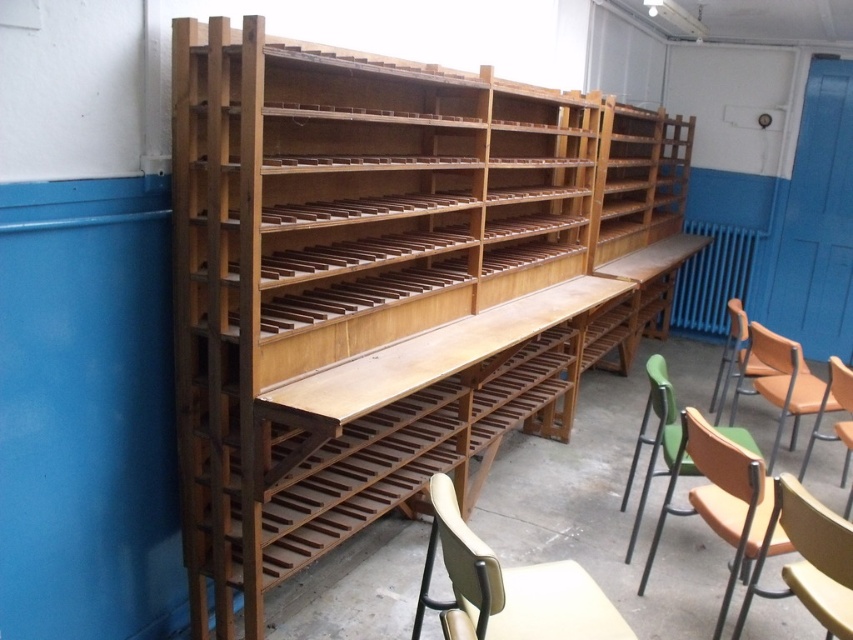
Between light brown wood chair at lower right and green plastic chair at right, which one has more height?

green plastic chair at right

Who is shorter, light brown wood chair at lower right or green plastic chair at right?

Standing shorter between the two is light brown wood chair at lower right.

Which is behind, point (784, 531) or point (721, 378)?

The point (721, 378) is behind.

This screenshot has height=640, width=853. I want to click on light brown wood chair at lower right, so click(816, 556).

Between point (663, 250) and point (793, 424), which one is positioned behind?

The point (663, 250) is behind.

Can you confirm if natural wood bookshelf at center is shorter than matte orange chair at right?

Incorrect, natural wood bookshelf at center's height does not fall short of matte orange chair at right's.

Which is in front, point (183, 484) or point (775, 442)?

Point (183, 484) is in front.

Identify the location of natural wood bookshelf at center. The image size is (853, 640). (384, 282).

Consider the image. Who is taller, green plastic chair at lower right or matte orange chair at right?

Standing taller between the two is green plastic chair at lower right.

Does point (659, 426) come farther from viewer compared to point (776, 336)?

No, it is in front of (776, 336).

Is point (689, 515) behind point (822, 387)?

No.

Locate an element on the screen. Image resolution: width=853 pixels, height=640 pixels. green plastic chair at lower right is located at coordinates (659, 449).